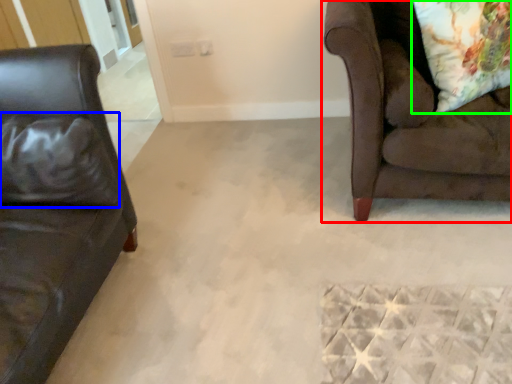
Question: Which object is positioned farthest from studio couch (highlighted by a red box)? Select from pillow (highlighted by a blue box) and throw pillow (highlighted by a green box).

Choices:
 (A) pillow
 (B) throw pillow

Answer: (A)